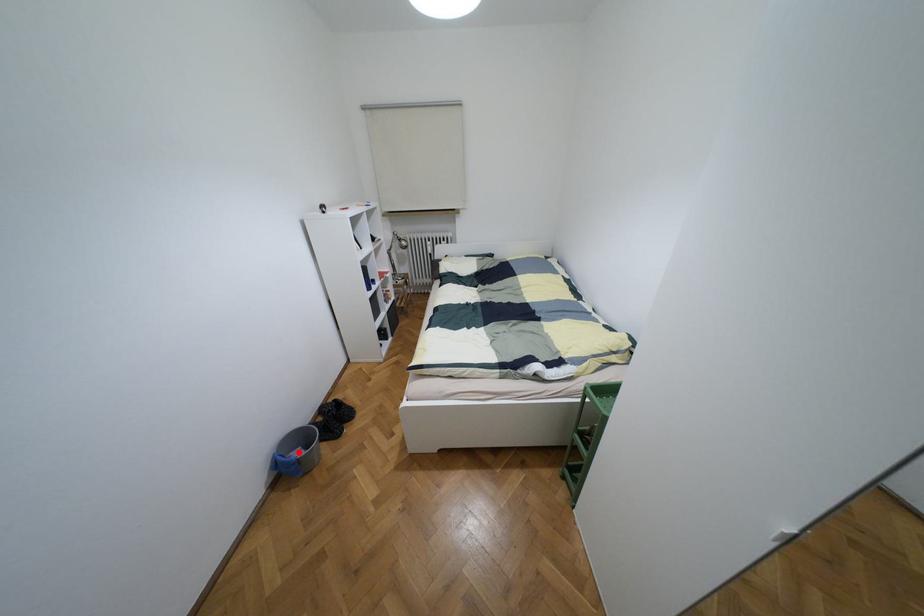
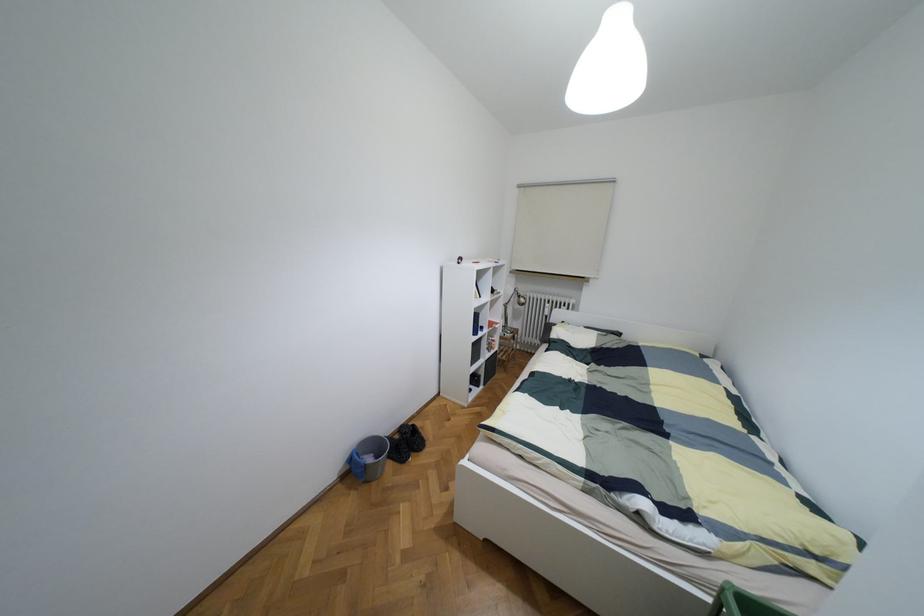
Find the pixel in the second image that matches the highlighted location in the first image.

(369, 459)